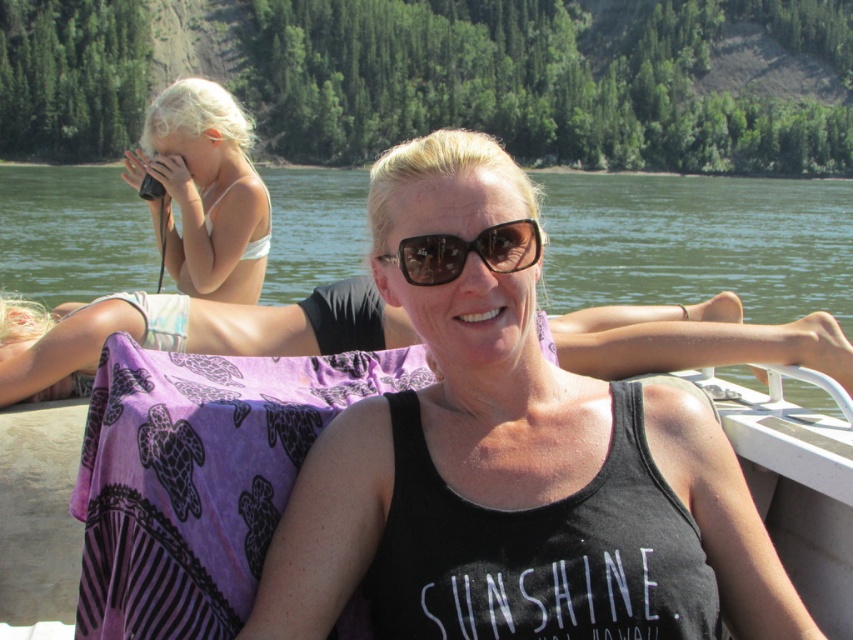
You are a photographer trying to capture the best shot of the black tank top at center and the brown matte sunglasses at center. Since you want to ensure both items are in focus, you need to know their positions relative to each other. Which object is positioned lower in the frame?

The black tank top at center is located below brown matte sunglasses at center, so the black tank top at center is positioned lower in the frame.

You are a photographer trying to capture a reflection of the clear water at center in the brown matte sunglasses at center. Based on the scene, can you confirm if the sunglasses are positioned in a way that allows this reflection?

The clear water at center is above the brown matte sunglasses at center, so the sunglasses are positioned below the water. This means the reflection of the water can be captured in the sunglasses since they are positioned below it.

You are a photographer trying to capture a clear shot of the black tank top at center and the brown matte sunglasses at center. Since you want to ensure both are visible, which object should you focus on first to account for their sizes?

The black tank top at center has a larger size compared to the brown matte sunglasses at center, so you should focus on the black tank top at center first to ensure it is in clear view before adjusting for the smaller sunglasses.